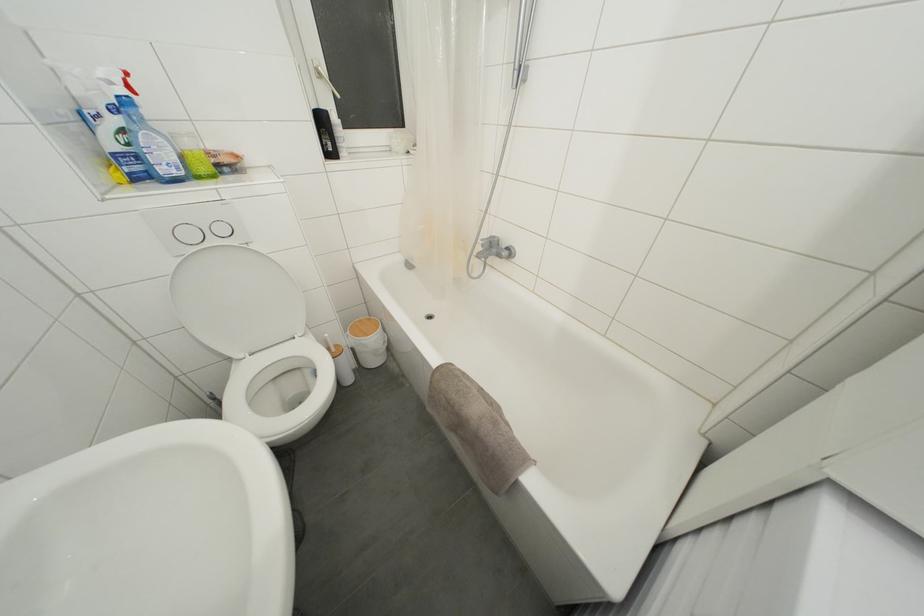
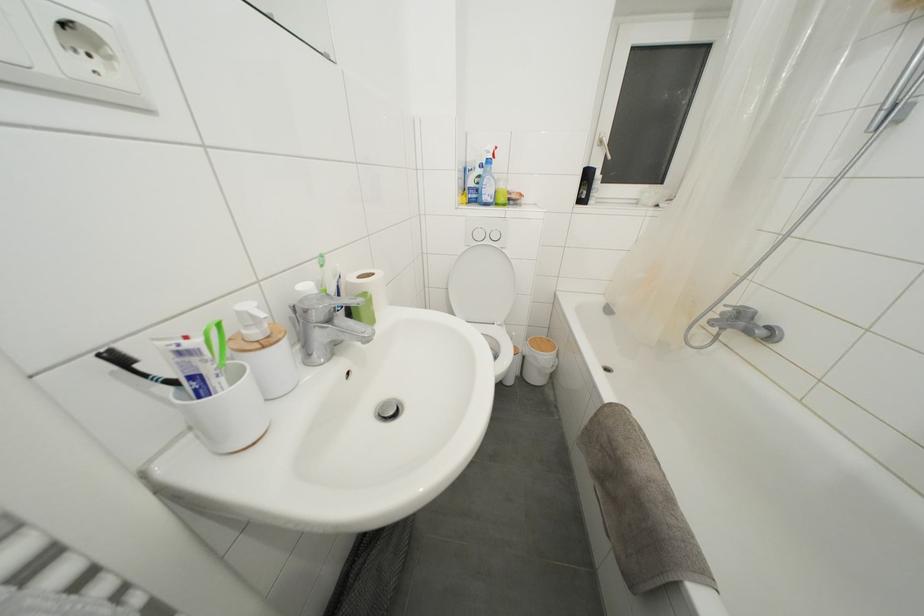
The point at (x=487, y=251) is marked in the first image. Where is the corresponding point in the second image?

(726, 318)